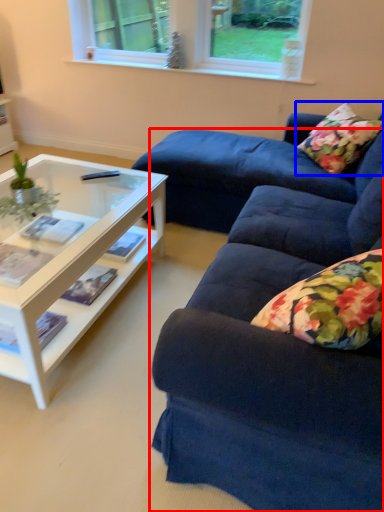
Question: Among these objects, which one is nearest to the camera, studio couch (highlighted by a red box) or pillow (highlighted by a blue box)?

Choices:
 (A) studio couch
 (B) pillow

Answer: (A)